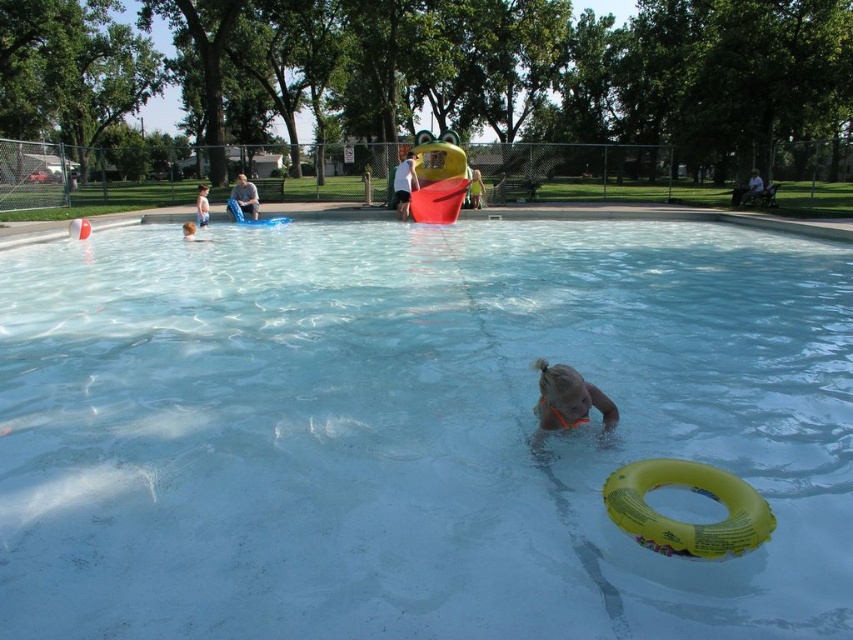
Looking at this image, you are a photographer standing at the edge of the pool. You want to take a picture of the white cotton shirt at upper center. However, you notice that the shirt is blurry in your shots. What might be the reason?

The white cotton shirt at upper center is 16.30 meters away from camera, so it might be too far away to capture clearly without a zoom lens or adjusting the camera settings for long distances.

You are a swimmer who wants to rest after swimming. You see the orange rubber ring at center and the light brown wooden bench at upper center. Which one is a better option for sitting?

The light brown wooden bench at upper center is a better option for sitting because the orange rubber ring at center is located below it and is likely floating in the water, making it unsuitable for sitting.